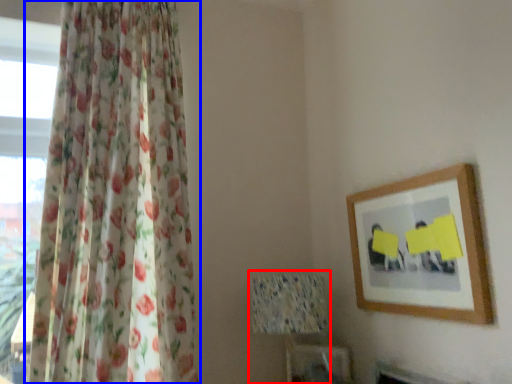
Question: Which of the following is the closest to the observer, table lamp (highlighted by a red box) or curtain (highlighted by a blue box)?

Choices:
 (A) table lamp
 (B) curtain

Answer: (B)